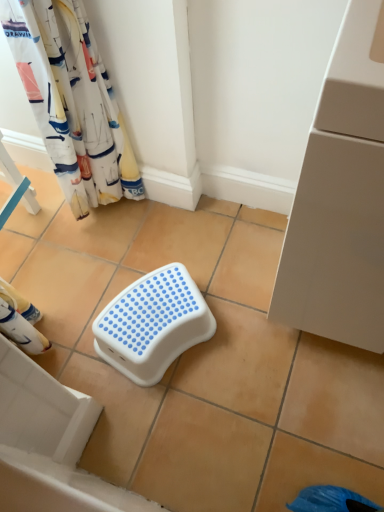
Find the location of a particular element. This screenshot has width=384, height=512. free spot behind white plastic step stool at center is located at coordinates (165, 247).